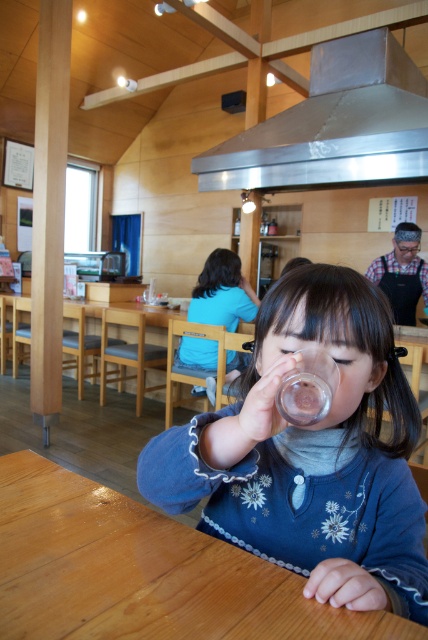
You are standing in the wooden interior space and want to move from point A to point B. Point A is at coordinate point[339,177] and point B is at coordinate point[237,316]. Which point is closer to you when you first enter the space?

Point A at coordinate point[339,177] is closer to the viewer than point B at coordinate point[237,316].

You are a fashion designer analyzing clothing items in the scene. You notice both the blue fabric sweater at center and the blue fabric shirt at center. Which clothing item has a narrower width?

The blue fabric sweater at center has a narrower width than the blue fabric shirt at center.